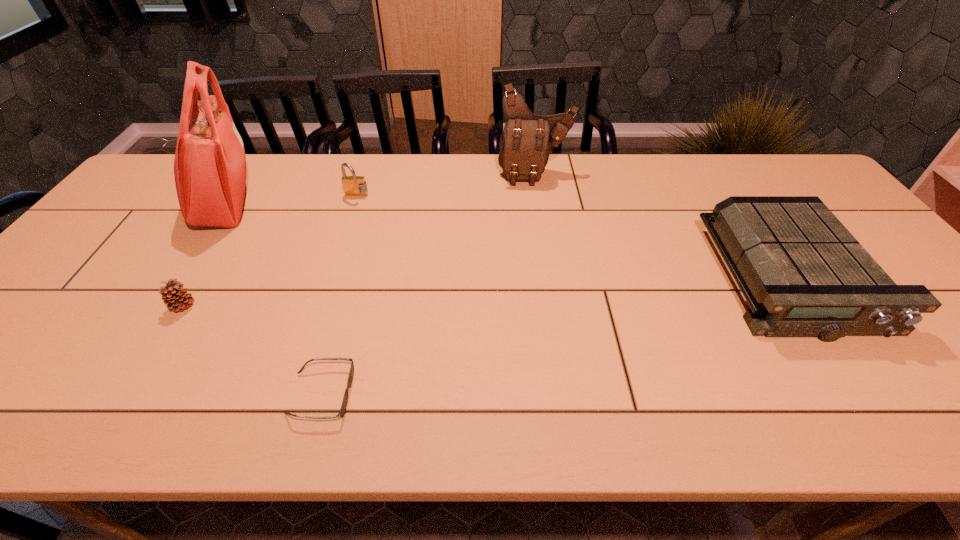
You are a GUI agent. You are given a task and a screenshot of the screen. Output one action in this format:
    pyautogui.click(x=<x>, y=<y>)
    Task: Click on the free location that satisfies the following two spatial constraints: 1. on the front-facing side of the fifth object from left to right; 2. on the front-facing side of the shortest object
    Image resolution: width=960 pixels, height=540 pixels.
    Given the screenshot: What is the action you would take?
    pyautogui.click(x=568, y=394)

Identify the location of blank space that satisfies the following two spatial constraints: 1. on the front-facing side of the handbag; 2. on the left side of the pinecone. This screenshot has height=540, width=960. (157, 306).

I want to click on free spot that satisfies the following two spatial constraints: 1. on the front-facing side of the shoulder bag; 2. on the front-facing side of the sunglasses, so click(x=568, y=394).